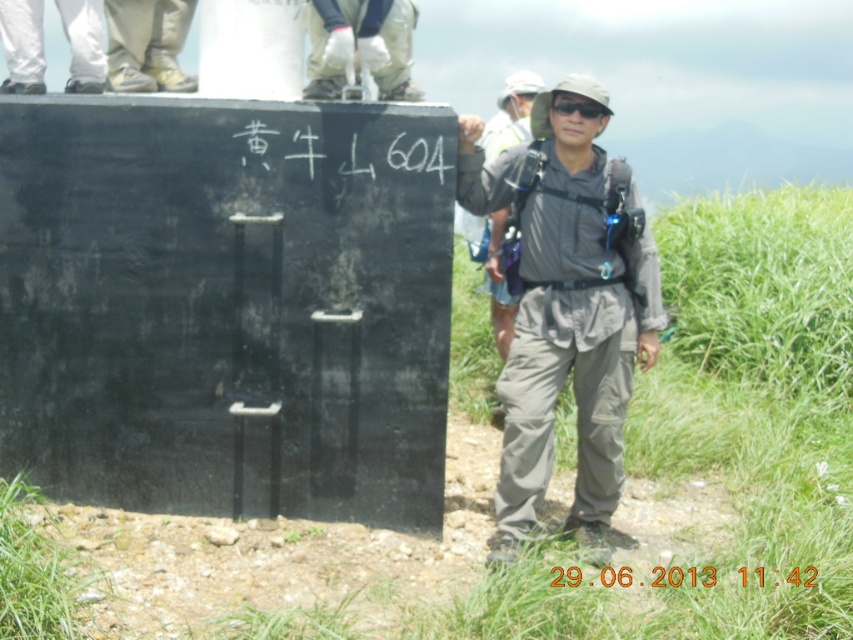
Is gray fabric jacket at center further to the viewer compared to black matte text at center?

Yes, gray fabric jacket at center is further from the viewer.

Which is in front, point (520, 225) or point (569, 573)?

Point (569, 573) is in front.

Who is more forward, (519, 417) or (630, 573)?

Point (519, 417) is more forward.

At what (x,y) coordinates should I click in order to perform the action: click on gray fabric jacket at center. Please return your answer as a coordinate pair (x, y). The height and width of the screenshot is (640, 853). Looking at the image, I should click on (566, 316).

Does point (657, 339) come farther from viewer compared to point (596, 108)?

That is True.

Does gray fabric jacket at center have a larger size compared to black matte goggles at center?

Yes, gray fabric jacket at center is bigger than black matte goggles at center.

Which is behind, point (579, 209) or point (560, 112)?

Positioned behind is point (579, 209).

I want to click on gray fabric jacket at center, so click(x=566, y=316).

Who is higher up, gray fabric jacket at center or light beige canvas shoes at upper left?

light beige canvas shoes at upper left is higher up.

Based on the photo, between gray fabric jacket at center and light beige canvas shoes at upper left, which one appears on the right side from the viewer's perspective?

gray fabric jacket at center

At what (x,y) coordinates should I click in order to perform the action: click on gray fabric jacket at center. Please return your answer as a coordinate pair (x, y). Looking at the image, I should click on (566, 316).

This screenshot has width=853, height=640. I want to click on gray fabric jacket at center, so click(x=566, y=316).